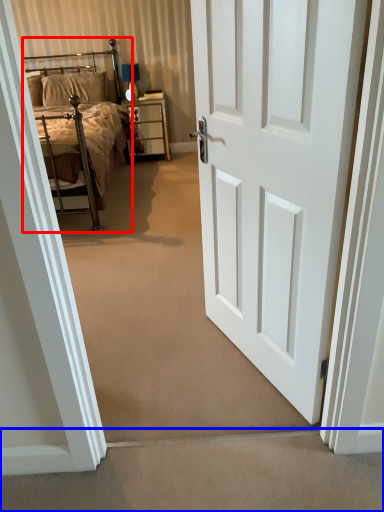
Question: Which object is closer to the camera taking this photo, bed (highlighted by a red box) or stairwell (highlighted by a blue box)?

Choices:
 (A) bed
 (B) stairwell

Answer: (B)